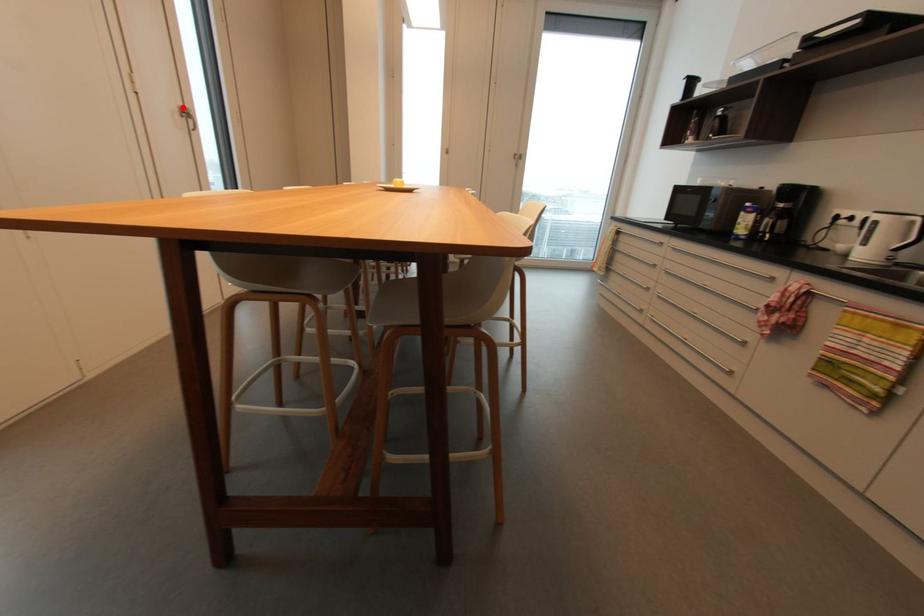
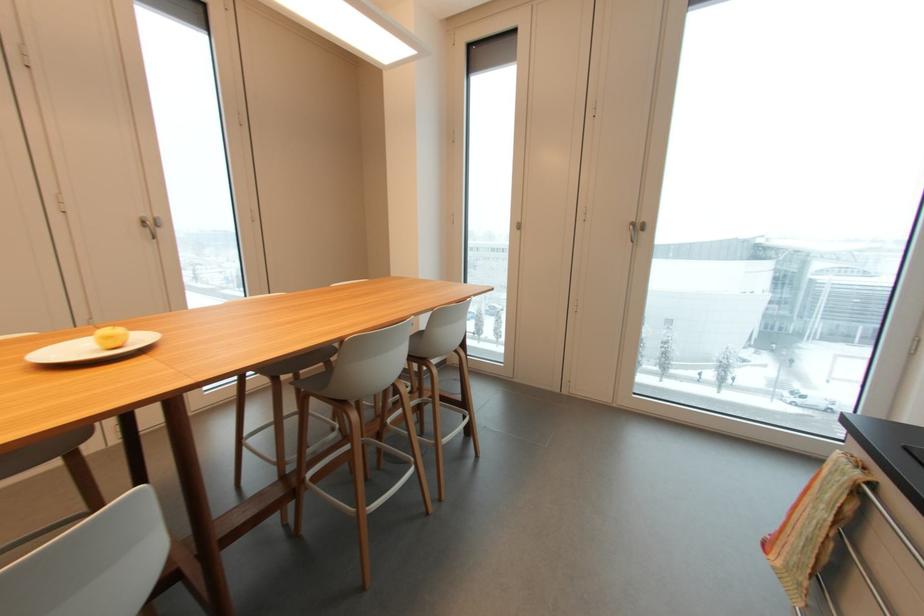
The point at the highlighted location is marked in the first image. Where is the corresponding point in the second image?

(143, 217)